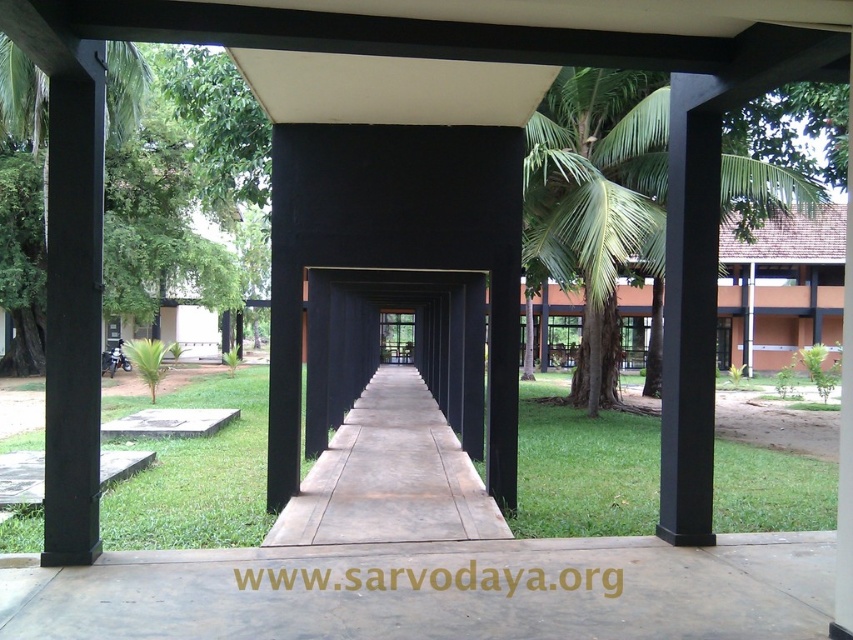
Can you confirm if green leafy tree at left is smaller than black matte pillar at left?

No.

Does point (154, 227) lie behind point (49, 160)?

Yes, it is.

Identify the location of green leafy tree at left. (164, 180).

Which is behind, point (126, 282) or point (386, 497)?

Positioned behind is point (126, 282).

Is green leafy tree at left wider than cement/path at center?

Correct, the width of green leafy tree at left exceeds that of cement/path at center.

Does point (4, 182) lie behind point (350, 444)?

Yes.

What are the coordinates of `green leafy tree at left` in the screenshot? It's located at (164, 180).

Can you confirm if green grass at center is positioned above green leafy tree at left?

No, green grass at center is not above green leafy tree at left.

Is green grass at center below green leafy tree at left?

Correct, green grass at center is located below green leafy tree at left.

What are the coordinates of `green grass at center` in the screenshot? It's located at (196, 476).